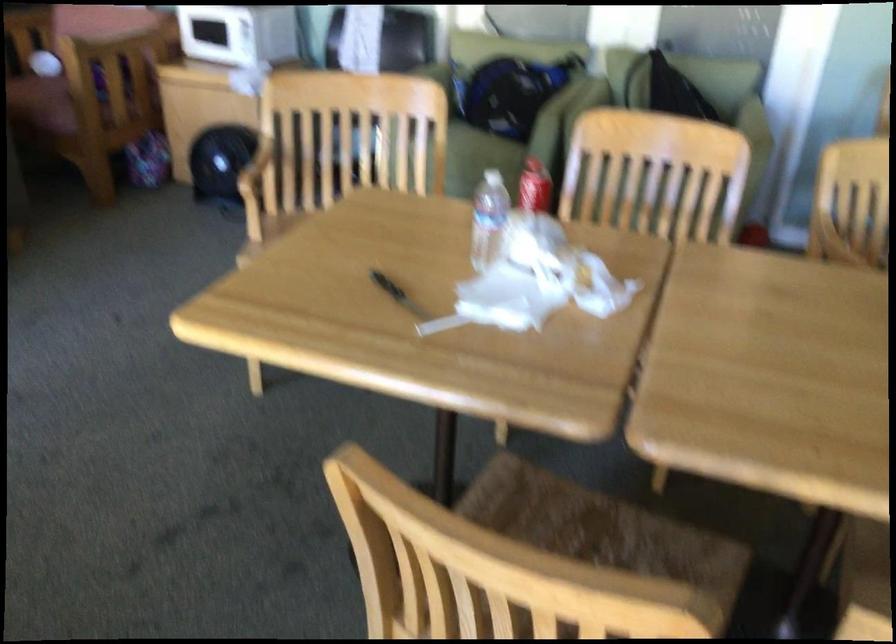
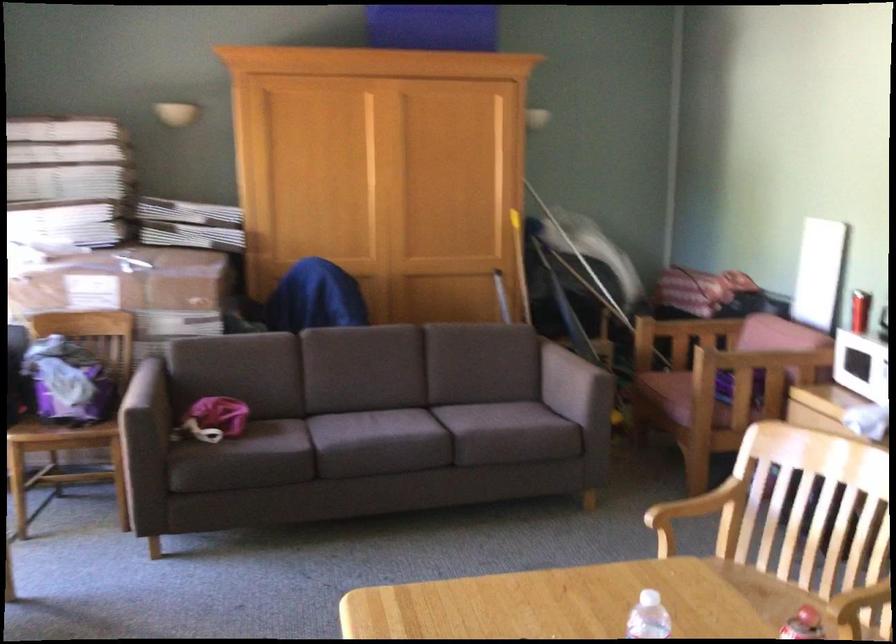
In the second image, find the point that corresponds to the point at 246,178 in the first image.

(694, 512)